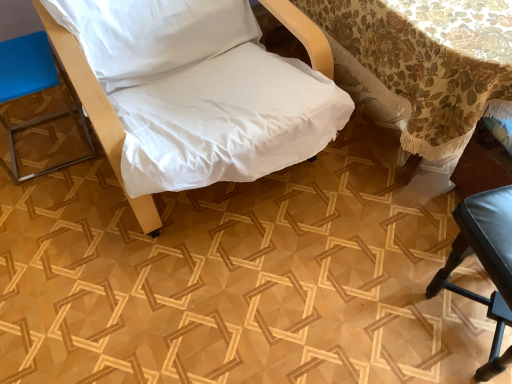
Question: Which direction should I rotate to look at white fabric chair at center, which is counted as the 2th furniture, starting from the left, — up or down?

Choices:
 (A) up
 (B) down

Answer: (A)

Question: Is black leather chair at lower right, placed as the third furniture when sorted from left to right, surrounding blue leather stool at left, the 1th furniture when ordered from left to right?

Choices:
 (A) yes
 (B) no

Answer: (B)

Question: Is black leather chair at lower right, placed as the third furniture when sorted from left to right, in contact with blue leather stool at left, the 1th furniture when ordered from left to right?

Choices:
 (A) no
 (B) yes

Answer: (A)

Question: Can you confirm if black leather chair at lower right, which is the 1th furniture from right to left, is taller than blue leather stool at left, marked as the third furniture in a right-to-left arrangement?

Choices:
 (A) no
 (B) yes

Answer: (B)

Question: Can you confirm if black leather chair at lower right, placed as the third furniture when sorted from left to right, is wider than blue leather stool at left, marked as the third furniture in a right-to-left arrangement?

Choices:
 (A) no
 (B) yes

Answer: (B)

Question: From the image's perspective, does black leather chair at lower right, which is the 1th furniture from right to left, appear lower than blue leather stool at left, the 1th furniture when ordered from left to right?

Choices:
 (A) yes
 (B) no

Answer: (A)

Question: Considering the relative sizes of black leather chair at lower right, which is the 1th furniture from right to left, and blue leather stool at left, the 1th furniture when ordered from left to right, in the image provided, is black leather chair at lower right, which is the 1th furniture from right to left, smaller than blue leather stool at left, the 1th furniture when ordered from left to right,?

Choices:
 (A) no
 (B) yes

Answer: (A)

Question: Is blue leather stool at left, marked as the third furniture in a right-to-left arrangement, wider than floral lace tablecloth at upper right?

Choices:
 (A) no
 (B) yes

Answer: (A)

Question: Is blue leather stool at left, marked as the third furniture in a right-to-left arrangement, placed right next to floral lace tablecloth at upper right?

Choices:
 (A) yes
 (B) no

Answer: (B)

Question: Does blue leather stool at left, the 1th furniture when ordered from left to right, lie behind floral lace tablecloth at upper right?

Choices:
 (A) no
 (B) yes

Answer: (B)

Question: From a real-world perspective, does blue leather stool at left, the 1th furniture when ordered from left to right, stand above floral lace tablecloth at upper right?

Choices:
 (A) yes
 (B) no

Answer: (B)

Question: Is blue leather stool at left, the 1th furniture when ordered from left to right, not close to floral lace tablecloth at upper right?

Choices:
 (A) yes
 (B) no

Answer: (A)

Question: Would you say blue leather stool at left, the 1th furniture when ordered from left to right, contains floral lace tablecloth at upper right?

Choices:
 (A) yes
 (B) no

Answer: (B)

Question: Considering the relative sizes of white fabric chair at center, which is counted as the second furniture, starting from the right, and blue leather stool at left, the 1th furniture when ordered from left to right, in the image provided, is white fabric chair at center, which is counted as the second furniture, starting from the right, wider than blue leather stool at left, the 1th furniture when ordered from left to right,?

Choices:
 (A) no
 (B) yes

Answer: (B)